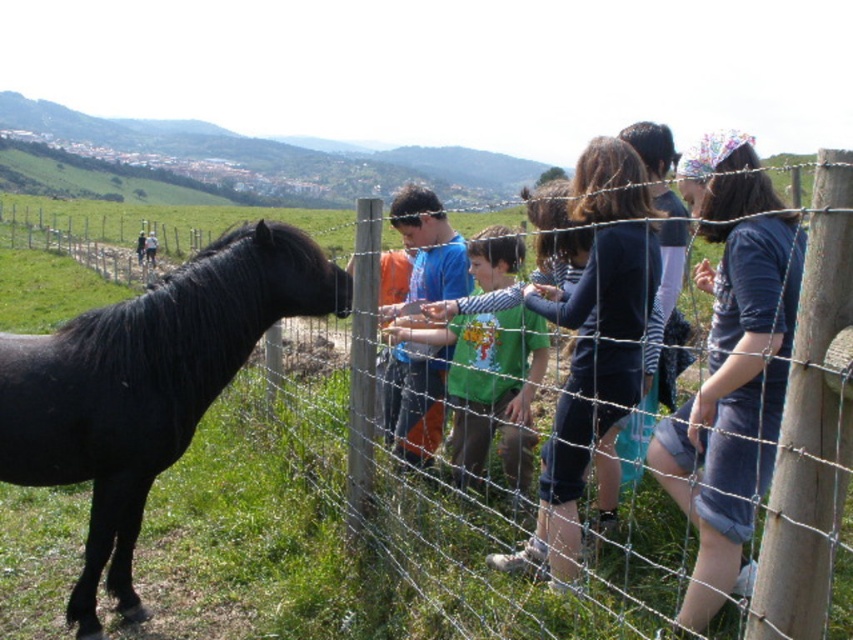
Question: Considering the real-world distances, which object is farthest from the black glossy horse at left?

Choices:
 (A) orange shirt at center
 (B) dark blue jeans at center
 (C) smooth black pony at left

Answer: (C)

Question: Based on their relative distances, which object is farther from the dark blue denim shorts at center?

Choices:
 (A) green matte shirt at center
 (B) blue t-shirt at center
 (C) smooth black pony at left
 (D) black glossy horse at left

Answer: (C)

Question: Is black glossy horse at left positioned behind dark blue shirt at center?

Choices:
 (A) yes
 (B) no

Answer: (A)

Question: Does dark blue jeans at center have a smaller size compared to green matte shirt at center?

Choices:
 (A) yes
 (B) no

Answer: (A)

Question: Is green matte shirt at center wider than blue t-shirt at center?

Choices:
 (A) no
 (B) yes

Answer: (B)

Question: Which is nearer to the dark blue denim shorts at center?

Choices:
 (A) black glossy horse at left
 (B) smooth black pony at left

Answer: (A)